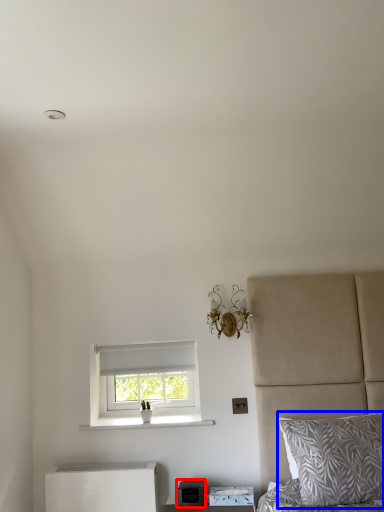
Question: Which of the following is the farthest to the observer, appliance (highlighted by a red box) or pillow (highlighted by a blue box)?

Choices:
 (A) appliance
 (B) pillow

Answer: (A)